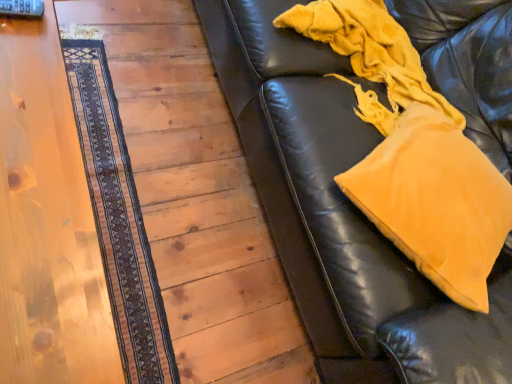
Where is `vacant space behind dark brown woven mat at left`? vacant space behind dark brown woven mat at left is located at coordinates (168, 115).